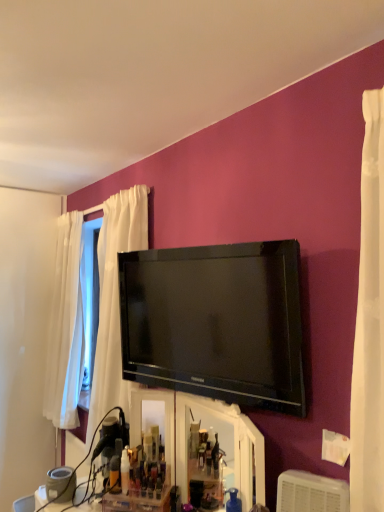
At what (x,y) coordinates should I click in order to perform the action: click on black glossy tv at upper center. Please return your answer as a coordinate pair (x, y). Looking at the image, I should click on (215, 322).

You are a GUI agent. You are given a task and a screenshot of the screen. Output one action in this format:
    pyautogui.click(x=<x>, y=<y>)
    Task: Click on the white plastic air conditioner at lower right
    This screenshot has width=384, height=512.
    Given the screenshot: What is the action you would take?
    pyautogui.click(x=311, y=493)

Is white plastic air conditioner at lower right looking in the opposite direction of black glossy tv at upper center?

That's not correct — white plastic air conditioner at lower right is not looking away from black glossy tv at upper center.

Which of these two, white plastic air conditioner at lower right or black glossy tv at upper center, is thinner?

Thinner between the two is black glossy tv at upper center.

What's the angular difference between white plastic air conditioner at lower right and black glossy tv at upper center's facing directions?

white plastic air conditioner at lower right and black glossy tv at upper center are facing 4.62 degrees away from each other.

Is the depth of white plastic air conditioner at lower right less than that of black glossy tv at upper center?

Yes.

Does translucent plastic bottle at center turn towards black glossy tv at upper center?

No, translucent plastic bottle at center is not turned towards black glossy tv at upper center.

Is translucent plastic bottle at center inside or outside of black glossy tv at upper center?

translucent plastic bottle at center is spatially situated outside black glossy tv at upper center.

Considering the points (127, 476) and (192, 288), which point is in front, point (127, 476) or point (192, 288)?

The point (192, 288) is more forward.

From a real-world perspective, relative to white plastic air conditioner at lower right, is black glossy tv at upper center vertically above or below?

black glossy tv at upper center is situated higher than white plastic air conditioner at lower right in the real world.

Which is in front, black glossy tv at upper center or white plastic air conditioner at lower right?

white plastic air conditioner at lower right is more forward.

Locate an element on the screen. television behind the white plastic air conditioner at lower right is located at coordinates (215, 322).

What's the angular difference between black glossy tv at upper center and white plastic air conditioner at lower right's facing directions?

They differ by 4.62 degrees in their facing directions.

From a real-world perspective, is white plastic air conditioner at lower right under translucent plastic bottle at center?

Incorrect, from a real-world perspective, white plastic air conditioner at lower right is higher than translucent plastic bottle at center.

Can you see white plastic air conditioner at lower right touching translucent plastic bottle at center?

They are not placed beside each other.

Is white plastic air conditioner at lower right aimed at translucent plastic bottle at center?

No, white plastic air conditioner at lower right is not oriented towards translucent plastic bottle at center.

In the image, is white plastic air conditioner at lower right positioned in front of or behind translucent plastic bottle at center?

Visually, white plastic air conditioner at lower right is located in front of translucent plastic bottle at center.

From the image's perspective, which is above, black glossy tv at upper center or translucent plastic bottle at center?

black glossy tv at upper center is shown above in the image.

Based on the photo, is black glossy tv at upper center next to translucent plastic bottle at center?

No, black glossy tv at upper center is not touching translucent plastic bottle at center.

Would you say black glossy tv at upper center is to the left or to the right of translucent plastic bottle at center in the picture?

Clearly, black glossy tv at upper center is on the right of translucent plastic bottle at center in the image.

Considering the relative sizes of black glossy tv at upper center and translucent plastic bottle at center in the image provided, is black glossy tv at upper center bigger than translucent plastic bottle at center?

Indeed, black glossy tv at upper center has a larger size compared to translucent plastic bottle at center.

Which object is more forward, translucent plastic bottle at center or white plastic air conditioner at lower right?

Positioned in front is white plastic air conditioner at lower right.

Considering the relative positions of translucent plastic bottle at center and white plastic air conditioner at lower right in the image provided, is translucent plastic bottle at center to the right of white plastic air conditioner at lower right from the viewer's perspective?

No.

Locate an element on the screen. This screenshot has width=384, height=512. air conditioner above the translucent plastic bottle at center (from a real-world perspective) is located at coordinates (311, 493).

Does translucent plastic bottle at center turn towards white plastic air conditioner at lower right?

No, translucent plastic bottle at center is not facing towards white plastic air conditioner at lower right.

Image resolution: width=384 pixels, height=512 pixels. Find the location of `television on the left of white plastic air conditioner at lower right`. television on the left of white plastic air conditioner at lower right is located at coordinates (215, 322).

In the image, there is a black glossy tv at upper center. At what (x,y) coordinates should I click in order to perform the action: click on toiletry below it (from the image's perspective). Please return your answer as a coordinate pair (x, y). Looking at the image, I should click on (125, 471).

Looking at the image, which one is located further to white plastic air conditioner at lower right, black glossy tv at upper center or translucent plastic bottle at center?

The object further to white plastic air conditioner at lower right is translucent plastic bottle at center.

Looking at the image, which one is located closer to black glossy tv at upper center, white plastic air conditioner at lower right or translucent plastic bottle at center?

white plastic air conditioner at lower right lies closer to black glossy tv at upper center than the other object.

Considering their positions, is black glossy tv at upper center positioned further to translucent plastic bottle at center than white plastic air conditioner at lower right?

white plastic air conditioner at lower right is positioned further to the anchor translucent plastic bottle at center.

Based on their spatial positions, is translucent plastic bottle at center or white plastic air conditioner at lower right further from black glossy tv at upper center?

translucent plastic bottle at center is positioned further to the anchor black glossy tv at upper center.

Estimate the real-world distances between objects in this image. Which object is further from white plastic air conditioner at lower right, translucent plastic bottle at center or black glossy tv at upper center?

Based on the image, translucent plastic bottle at center appears to be further to white plastic air conditioner at lower right.

Based on the photo, considering their positions, is white plastic air conditioner at lower right positioned further to translucent plastic bottle at center than black glossy tv at upper center?

Based on the image, white plastic air conditioner at lower right appears to be further to translucent plastic bottle at center.

At what (x,y) coordinates should I click in order to perform the action: click on air conditioner between black glossy tv at upper center and translucent plastic bottle at center vertically. Please return your answer as a coordinate pair (x, y). The width and height of the screenshot is (384, 512). Looking at the image, I should click on (311, 493).